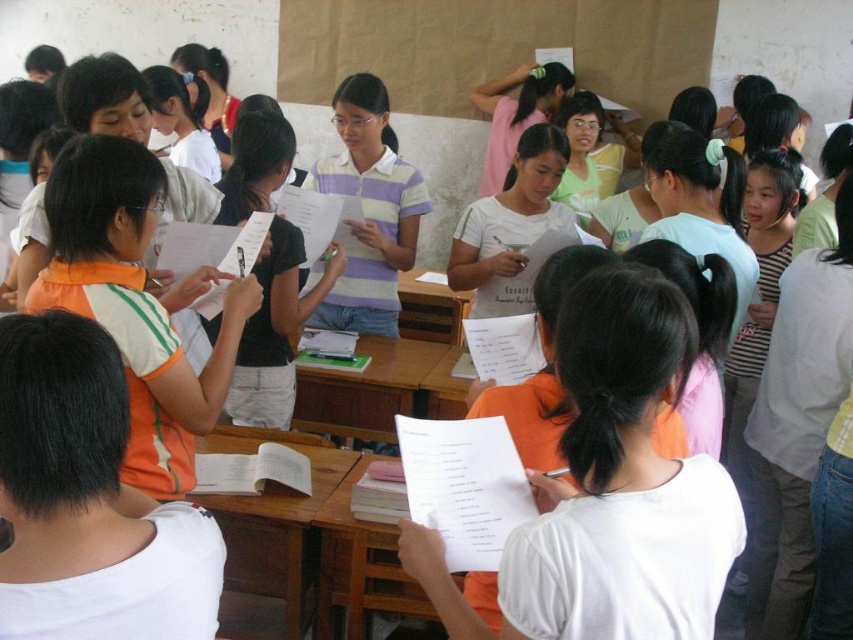
What do you see at coordinates (136, 301) in the screenshot? The height and width of the screenshot is (640, 853). I see `orange striped shirt at left` at bounding box center [136, 301].

Measure the distance between orange striped shirt at left and black matte shirt at center.

orange striped shirt at left is 26.12 inches from black matte shirt at center.

Is point (115, 326) positioned behind point (329, 260)?

No, it is not.

You are a GUI agent. You are given a task and a screenshot of the screen. Output one action in this format:
    pyautogui.click(x=<x>, y=<y>)
    Task: Click on the orange striped shirt at left
    
    Given the screenshot: What is the action you would take?
    pyautogui.click(x=136, y=301)

Is black matte shirt at center to the right of striped cotton shirt at center from the viewer's perspective?

In fact, black matte shirt at center is to the left of striped cotton shirt at center.

At what (x,y) coordinates should I click in order to perform the action: click on black matte shirt at center. Please return your answer as a coordinate pair (x, y). The width and height of the screenshot is (853, 640). Looking at the image, I should click on (276, 328).

Who is shorter, orange striped shirt at left or striped cotton shirt at center?

orange striped shirt at left is shorter.

Does orange striped shirt at left appear under striped cotton shirt at center?

Yes.

Is point (165, 321) closer to viewer compared to point (329, 173)?

Yes, point (165, 321) is in front of point (329, 173).

Find the location of a particular element. orange striped shirt at left is located at coordinates (136, 301).